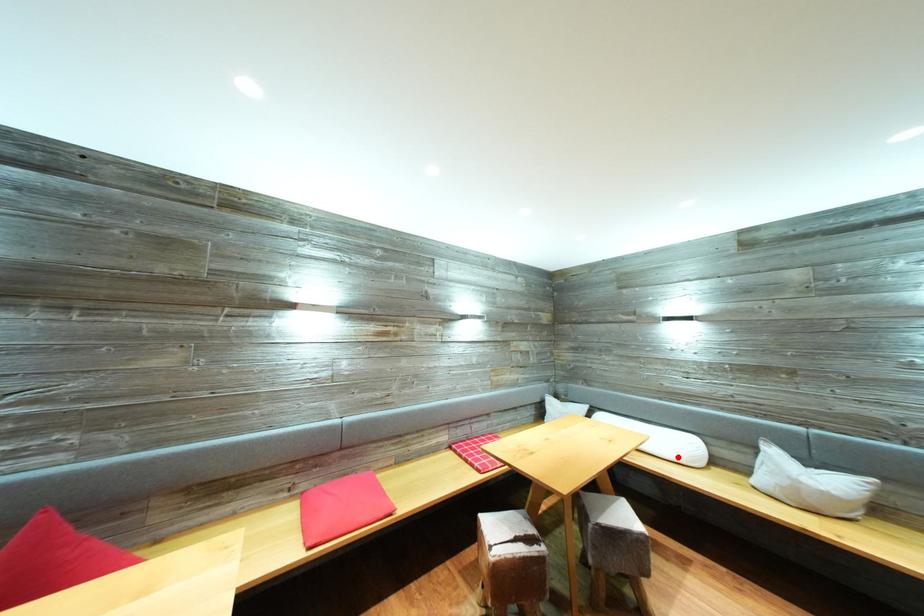
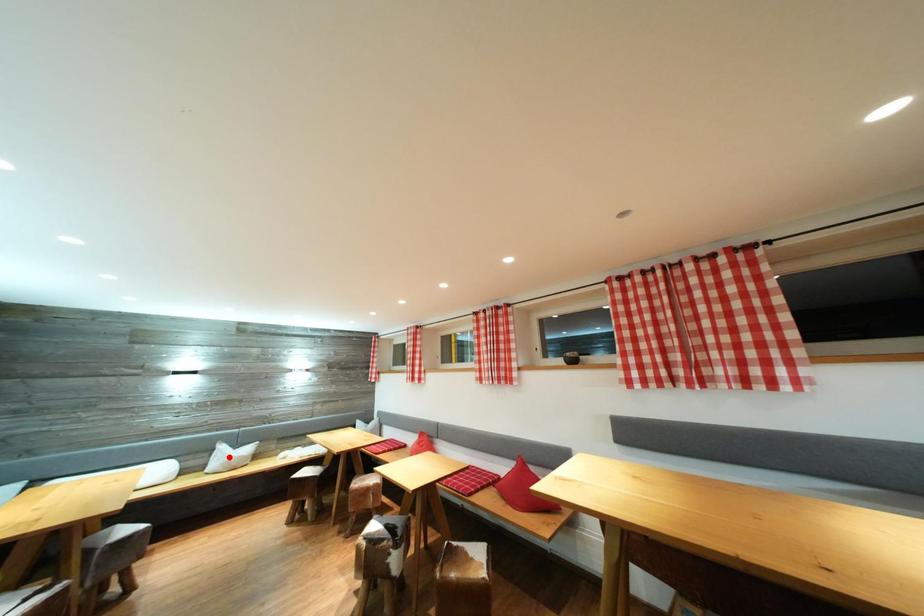
I am providing you with two images of the same scene from different viewpoints. A red point is marked on the first image and another point is marked on the second image. Is the marked point in image1 the same physical position as the marked point in image2?

No